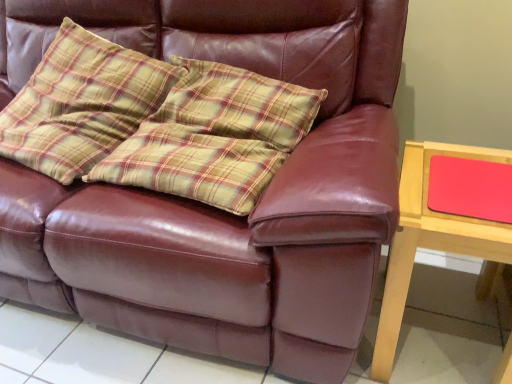
Question: Is point (45, 135) closer or farther from the camera than point (394, 253)?

Choices:
 (A) closer
 (B) farther

Answer: (B)

Question: From a real-world perspective, is plaid fabric pillow at upper left positioned above or below wooden table at right?

Choices:
 (A) below
 (B) above

Answer: (B)

Question: Estimate the real-world distances between objects in this image. Which object is farther from the wooden table at right?

Choices:
 (A) matte red mousepad at right
 (B) plaid fabric pillow at upper left

Answer: (B)

Question: Estimate the real-world distances between objects in this image. Which object is closer to the plaid fabric pillow at upper left?

Choices:
 (A) wooden table at right
 (B) matte red mousepad at right

Answer: (A)